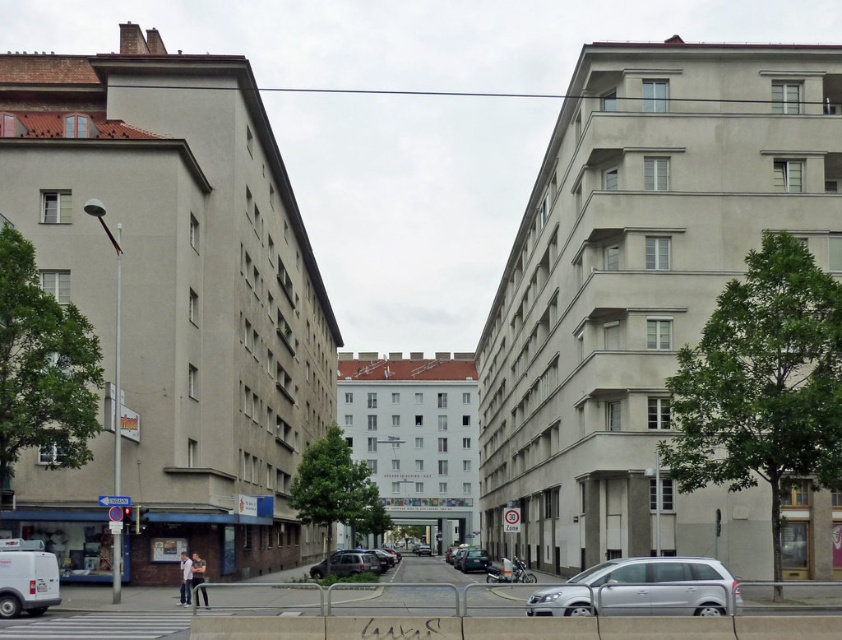
Which is more to the right, silver metallic car at lower center or metallic silver sedan at center?

silver metallic car at lower center is more to the right.

Describe the element at coordinates (640, 588) in the screenshot. Image resolution: width=842 pixels, height=640 pixels. I see `silver metallic car at lower center` at that location.

What do you see at coordinates (640, 588) in the screenshot?
I see `silver metallic car at lower center` at bounding box center [640, 588].

At what (x,y) coordinates should I click in order to perform the action: click on silver metallic car at lower center. Please return your answer as a coordinate pair (x, y). The image size is (842, 640). Looking at the image, I should click on (640, 588).

Is the position of silver metallic car at lower center more distant than that of matte black car at center?

No, silver metallic car at lower center is in front of matte black car at center.

Which is below, silver metallic car at lower center or matte black car at center?

matte black car at center is lower down.

Locate an element on the screen. The width and height of the screenshot is (842, 640). silver metallic car at lower center is located at coordinates (640, 588).

Between point (333, 556) and point (467, 566), which one is positioned in front?

Point (333, 556) is more forward.

Consider the image. Which of these two, matte black car at center or metallic silver sedan at center, stands taller?

matte black car at center

Does point (374, 560) lie in front of point (461, 563)?

That is True.

This screenshot has width=842, height=640. What are the coordinates of `matte black car at center` in the screenshot? It's located at (345, 564).